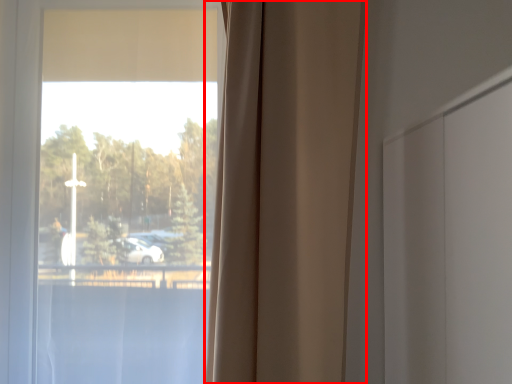
Question: From the image, what is the correct spatial relationship of curtain (annotated by the red box) in relation to window?

Choices:
 (A) right
 (B) left

Answer: (A)